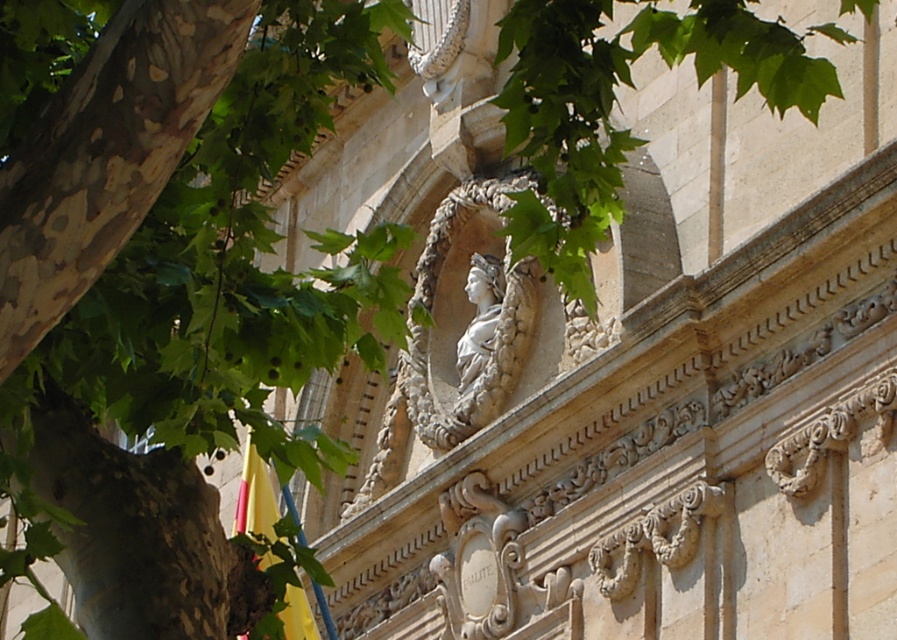
Can you confirm if white stone bust at center is positioned below white marble bust at center?

Yes, white stone bust at center is below white marble bust at center.

Is white stone bust at center above white marble bust at center?

No, white stone bust at center is not above white marble bust at center.

Locate an element on the screen. Image resolution: width=897 pixels, height=640 pixels. white stone bust at center is located at coordinates (460, 316).

This screenshot has height=640, width=897. What are the coordinates of `white stone bust at center` in the screenshot? It's located at (460, 316).

Does white stone bust at center have a larger size compared to yellow fabric at lower left?

No.

Between point (503, 332) and point (299, 632), which one is positioned behind?

The point (503, 332) is more distant.

In order to click on white stone bust at center in this screenshot , I will do `click(460, 316)`.

Who is taller, yellow fabric at lower left or white marble bust at center?

Standing taller between the two is yellow fabric at lower left.

Is point (289, 637) positioned after point (469, 364)?

No.

Image resolution: width=897 pixels, height=640 pixels. Describe the element at coordinates (255, 496) in the screenshot. I see `yellow fabric at lower left` at that location.

The height and width of the screenshot is (640, 897). Find the location of `yellow fabric at lower left`. yellow fabric at lower left is located at coordinates (255, 496).